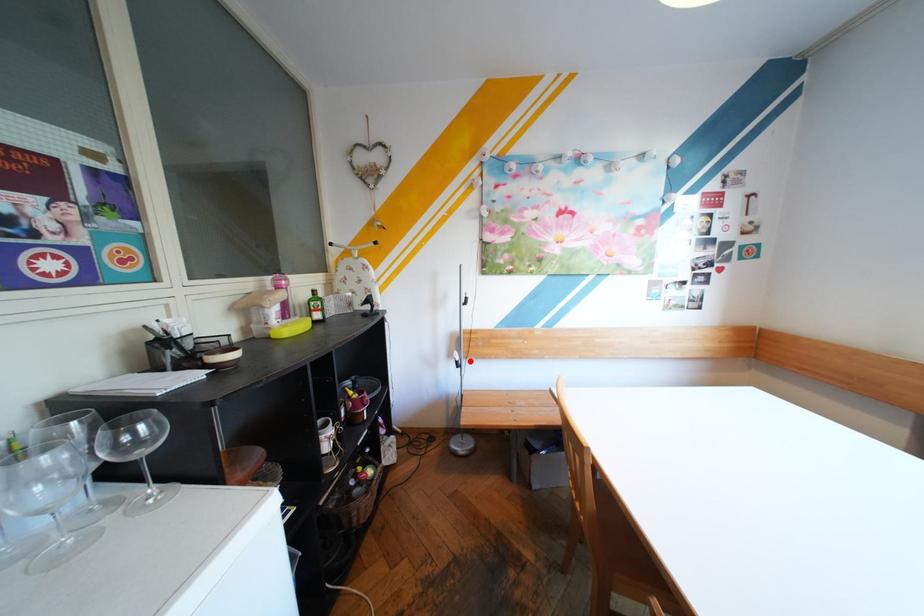
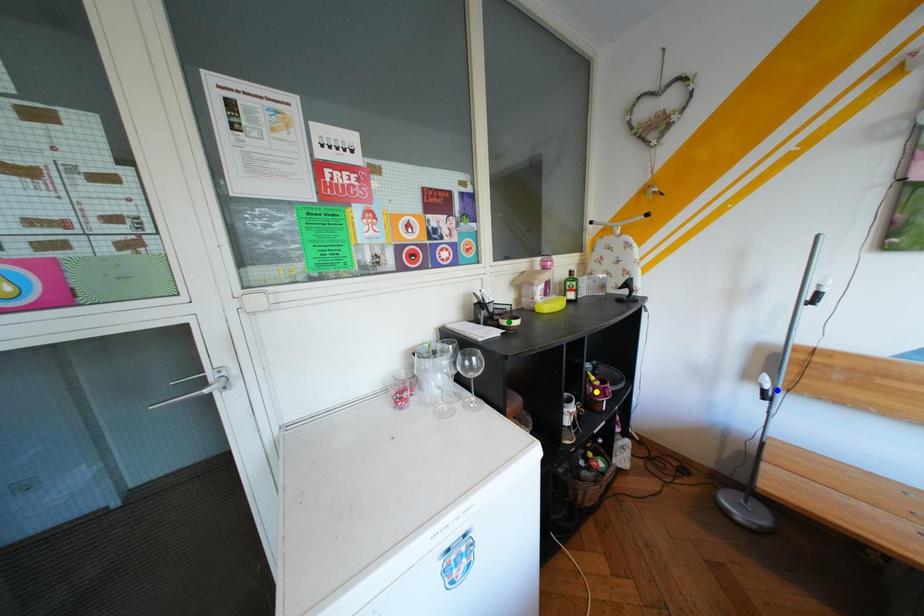
Question: I am providing you with two images of the same scene from different viewpoints. A red point is marked on the first image. You are given multiple points on the second image. Can you choose the point in image 2 that corresponds to the point in image 1?

Choices:
 (A) yellow point
 (B) green point
 (C) blue point

Answer: (C)